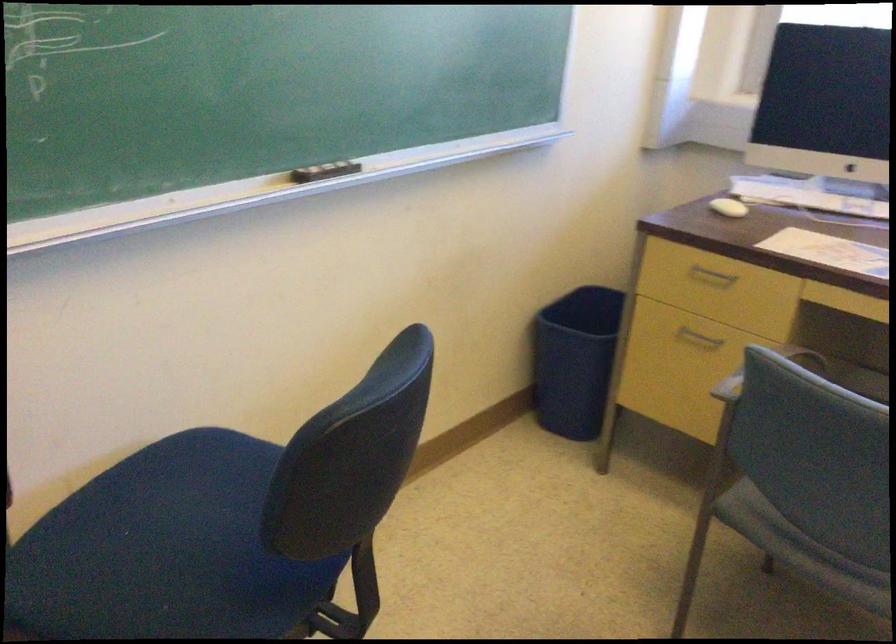
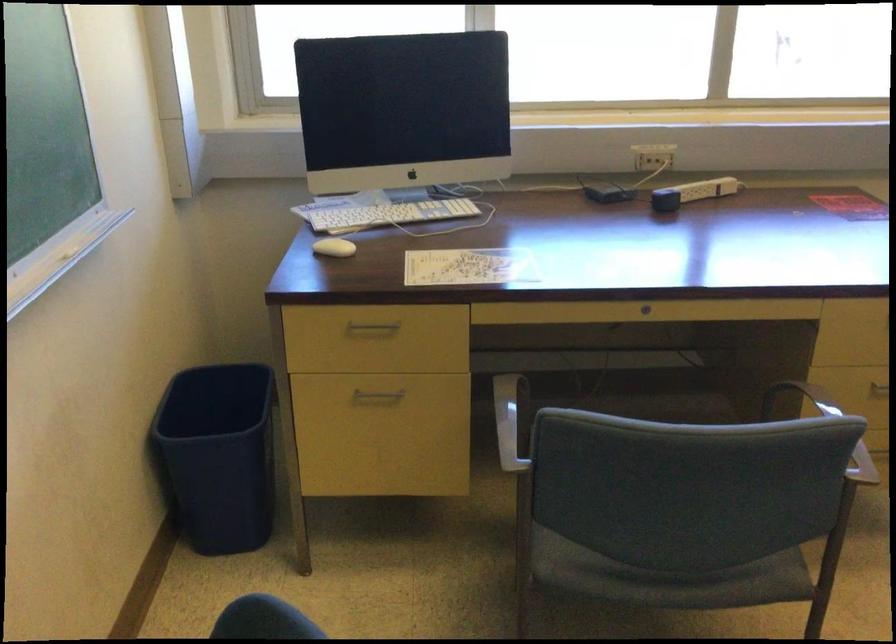
Where in the second image is the point corresponding to [730,203] from the first image?

(333, 247)